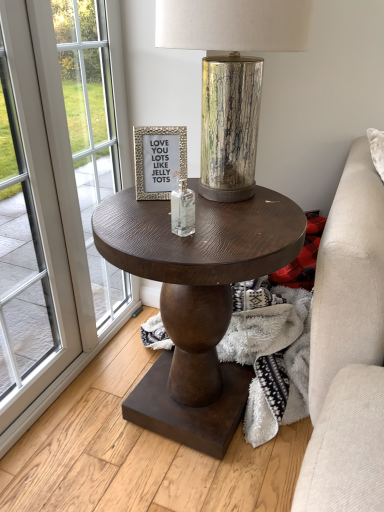
The height and width of the screenshot is (512, 384). Identify the location of free space that is in between gold textured lamp at center and clear glass bottle at center. (201, 222).